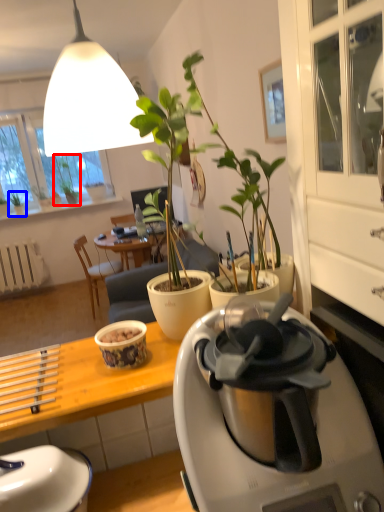
Question: Which point is closer to the camera, houseplant (highlighted by a red box) or houseplant (highlighted by a blue box)?

Choices:
 (A) houseplant
 (B) houseplant

Answer: (B)